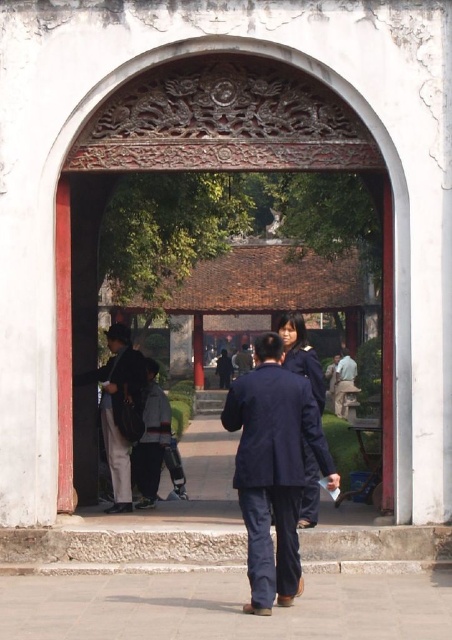
Question: Which point is closer to the camera?

Choices:
 (A) (236, 368)
 (B) (108, 449)
 (C) (343, 364)

Answer: (B)

Question: Does light brown leather jacket at center appear on the left side of dark blue uniform at center?

Choices:
 (A) yes
 (B) no

Answer: (B)

Question: Which point is closer to the camera?

Choices:
 (A) (320, 387)
 (B) (113, 483)
 (C) (258, 529)

Answer: (C)

Question: Does navy blue suit at center come in front of navy blue fabric business suit at center?

Choices:
 (A) no
 (B) yes

Answer: (B)

Question: Based on their relative distances, which object is nearer to the navy blue suit at center?

Choices:
 (A) dark blue uniform at center
 (B) light brown leather jacket at center

Answer: (A)

Question: Can you confirm if dark blue fabric jacket at center is positioned below navy blue fabric business suit at center?

Choices:
 (A) no
 (B) yes

Answer: (B)